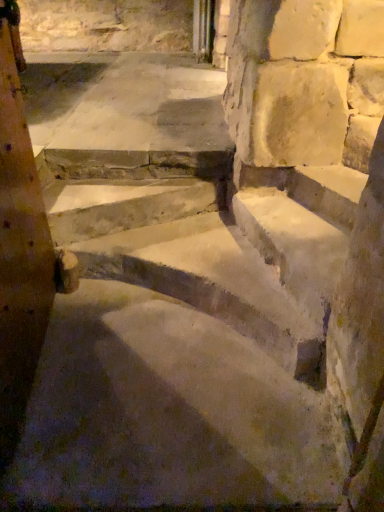
This screenshot has height=512, width=384. What are the coordinates of `wooden post at left` in the screenshot? It's located at (19, 243).

What do you see at coordinates (19, 243) in the screenshot?
I see `wooden post at left` at bounding box center [19, 243].

What is the approximate width of wooden post at left?

It is 10.09 inches.

Measure the distance between point (x=18, y=117) and camera.

Point (x=18, y=117) is 1.60 meters from camera.

Locate an element on the screen. This screenshot has height=512, width=384. wooden post at left is located at coordinates (19, 243).